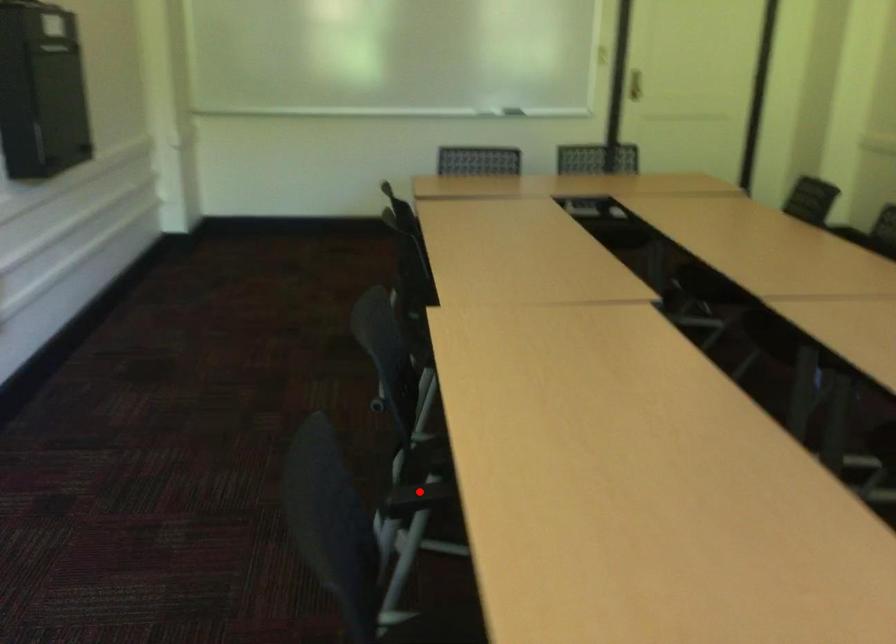
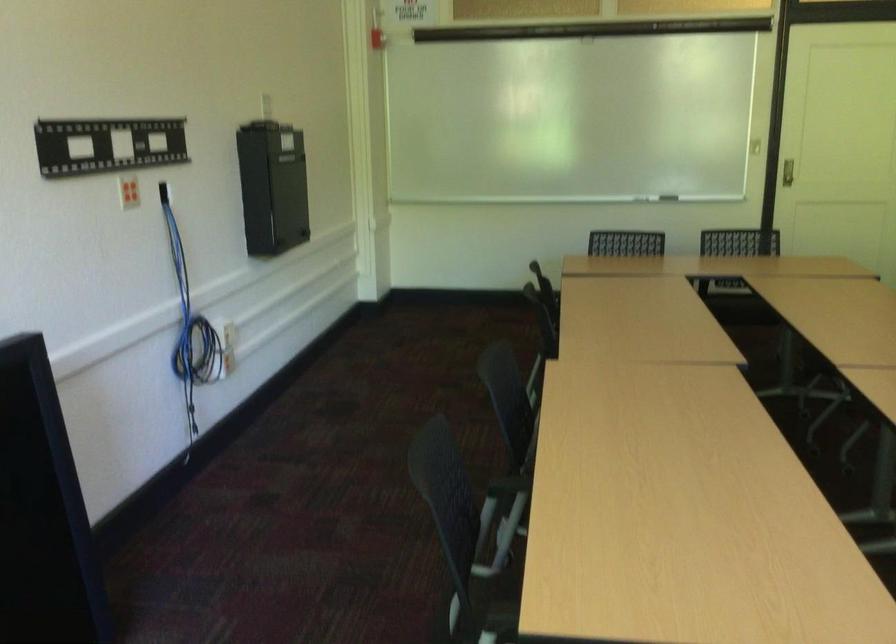
The point at the highlighted location is marked in the first image. Where is the corresponding point in the second image?

(506, 486)